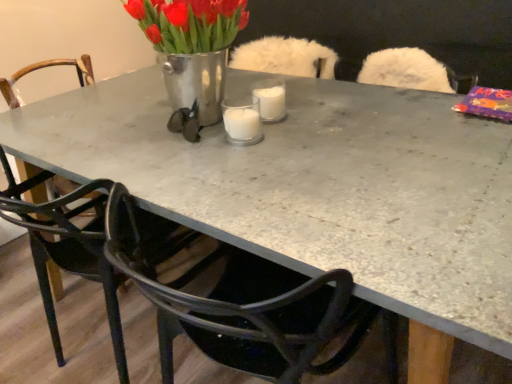
Image resolution: width=512 pixels, height=384 pixels. In order to click on vacant area to the right of clear glass candle at center in this screenshot , I will do `click(311, 129)`.